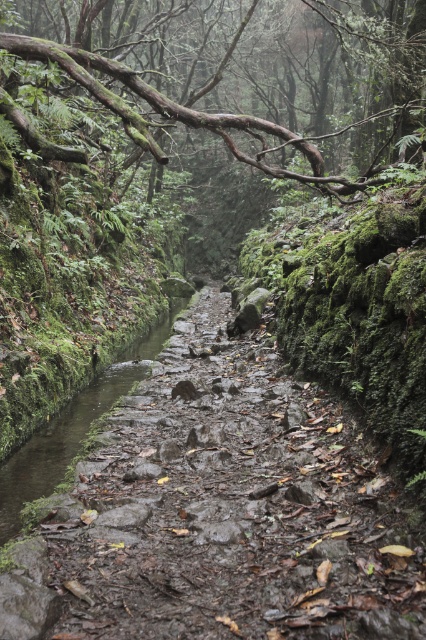
Question: Does brown rough branch at upper center appear on the right side of muddy stone stream at center?

Choices:
 (A) no
 (B) yes

Answer: (A)

Question: Which point is closer to the camera taking this photo?

Choices:
 (A) (31, 454)
 (B) (215, 83)

Answer: (A)

Question: Does brown rough branch at upper center have a larger size compared to muddy stone stream at center?

Choices:
 (A) no
 (B) yes

Answer: (B)

Question: Can you confirm if brown rough branch at upper center is positioned below muddy stone stream at center?

Choices:
 (A) no
 (B) yes

Answer: (A)

Question: Which object appears farthest from the camera in this image?

Choices:
 (A) brown rough branch at upper center
 (B) muddy stone stream at center

Answer: (A)

Question: Which of the following is the closest to the observer?

Choices:
 (A) brown rough branch at upper center
 (B) muddy stone stream at center

Answer: (B)